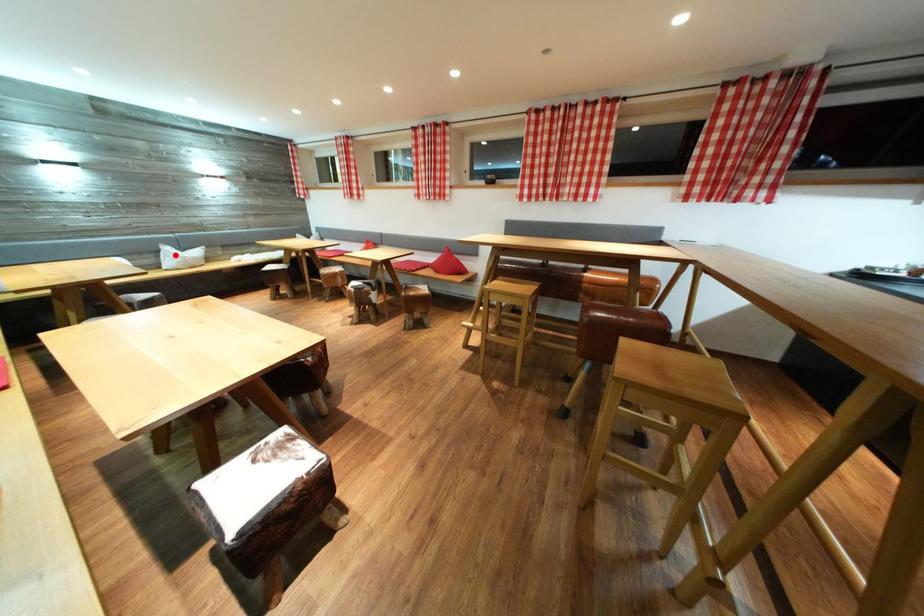
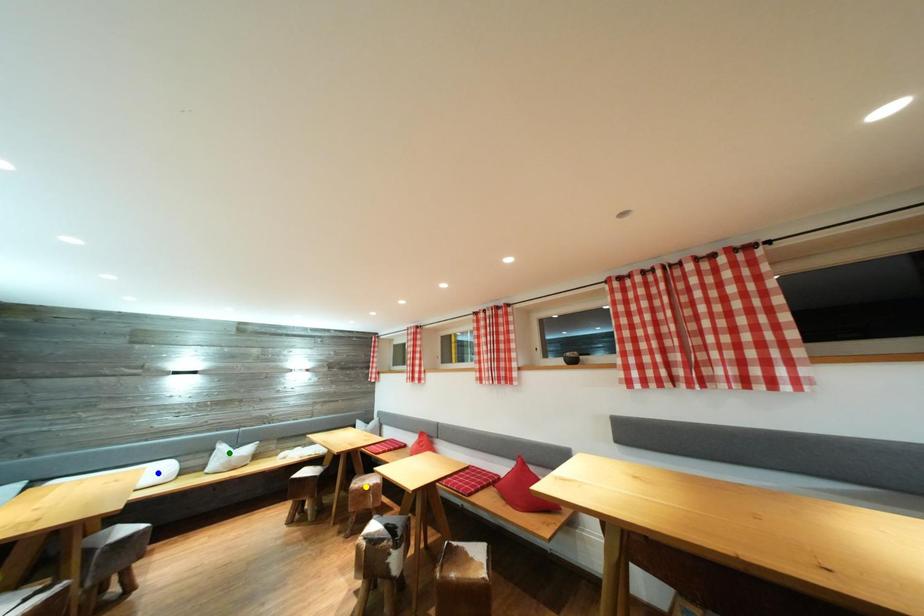
Question: I am providing you with two images of the same scene from different viewpoints. A red point is marked on the first image. You are given multiple points on the second image. Which spot in image 2 lines up with the point in image 1?

Choices:
 (A) green point
 (B) yellow point
 (C) blue point

Answer: (A)